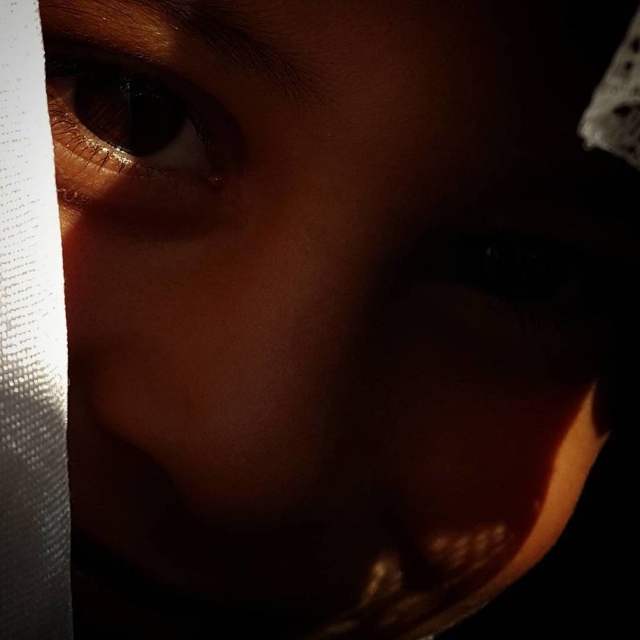
Who is positioned more to the left, brown matte eye at upper left or black matte eye at center?

Positioned to the left is brown matte eye at upper left.

This screenshot has width=640, height=640. Describe the element at coordinates (132, 134) in the screenshot. I see `brown matte eye at upper left` at that location.

Describe the element at coordinates (132, 134) in the screenshot. The height and width of the screenshot is (640, 640). I see `brown matte eye at upper left` at that location.

This screenshot has height=640, width=640. Identify the location of brown matte eye at upper left. (132, 134).